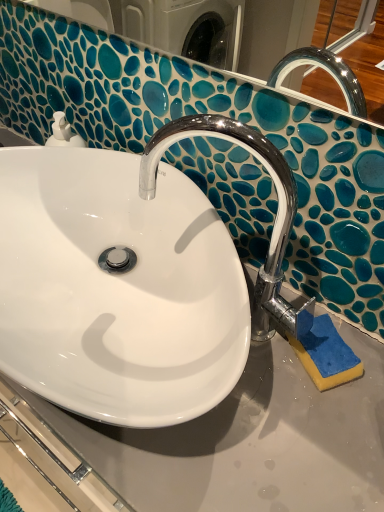
At what (x,y) coordinates should I click in order to perform the action: click on vacant space positioned to the left of blue sponge at lower right. Please return your answer as a coordinate pair (x, y). This screenshot has height=512, width=384. Looking at the image, I should click on (244, 388).